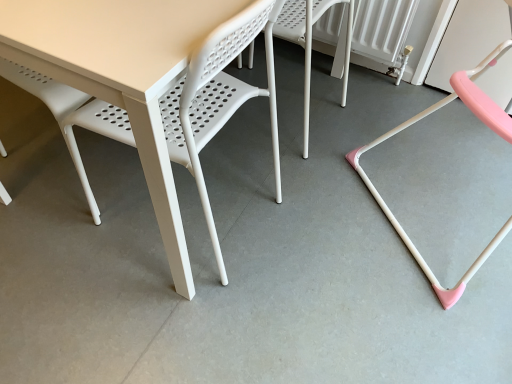
Locate an element on the screen. Image resolution: width=512 pixels, height=384 pixels. vacant area that lies between pink plastic chair at right, which is counted as the second chair, starting from the left, and white plastic table at center is located at coordinates (328, 213).